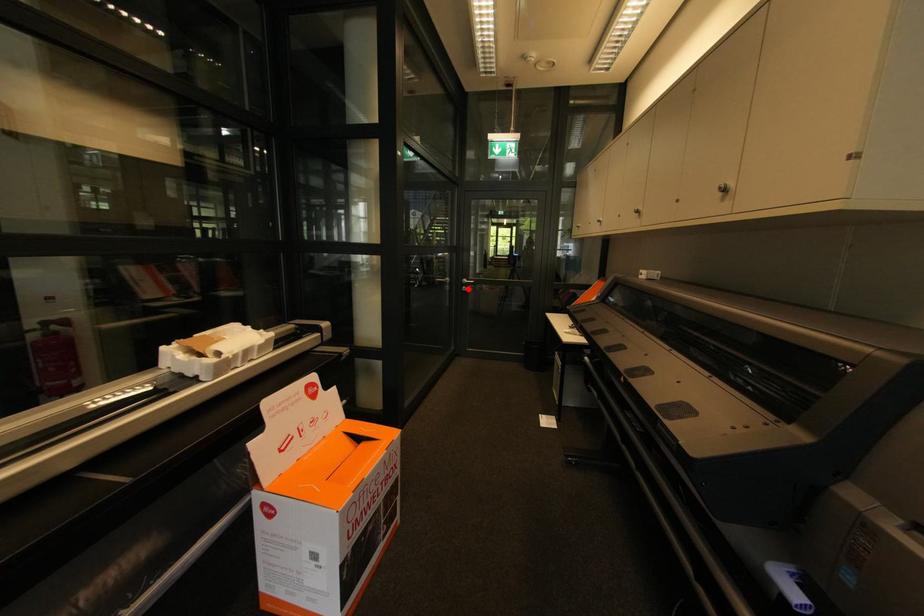
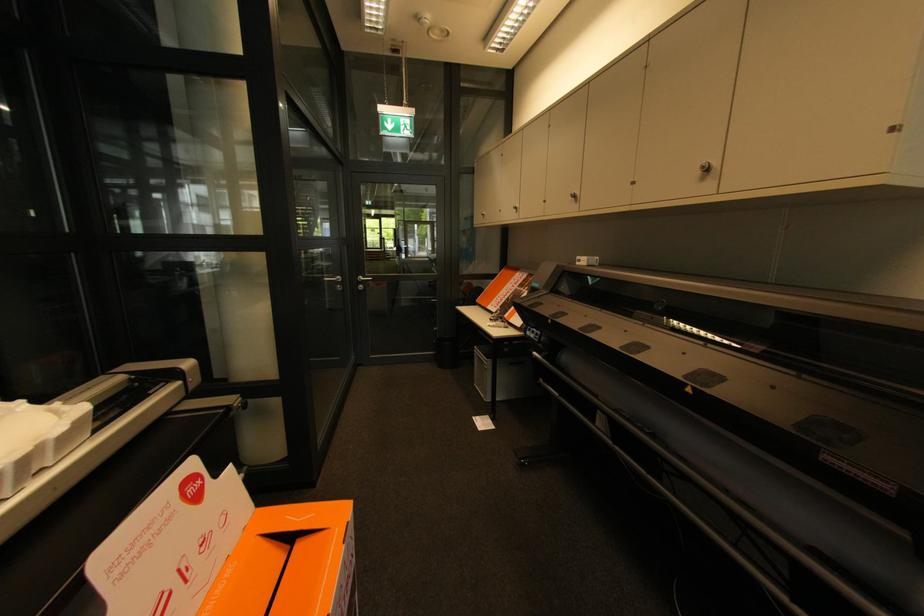
Find the pixel in the second image that matches the highlighted location in the first image.

(365, 286)